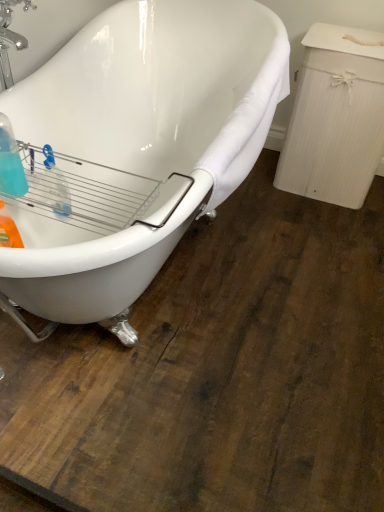
Question: Based on their sizes in the image, would you say white glossy bathtub at upper left is bigger or smaller than translucent plastic bottle at left?

Choices:
 (A) big
 (B) small

Answer: (A)

Question: Is white glossy bathtub at upper left spatially inside translucent plastic bottle at left, or outside of it?

Choices:
 (A) inside
 (B) outside

Answer: (B)

Question: In the image, is white glossy bathtub at upper left positioned in front of or behind translucent plastic bottle at left?

Choices:
 (A) front
 (B) behind

Answer: (A)

Question: From a real-world perspective, is translucent plastic bottle at left above or below white glossy bathtub at upper left?

Choices:
 (A) below
 (B) above

Answer: (B)

Question: Is translucent plastic bottle at left inside the boundaries of white glossy bathtub at upper left, or outside?

Choices:
 (A) outside
 (B) inside

Answer: (B)

Question: Looking at the image, does translucent plastic bottle at left seem bigger or smaller compared to white glossy bathtub at upper left?

Choices:
 (A) big
 (B) small

Answer: (B)

Question: Would you say translucent plastic bottle at left is to the left or to the right of white glossy bathtub at upper left in the picture?

Choices:
 (A) left
 (B) right

Answer: (A)